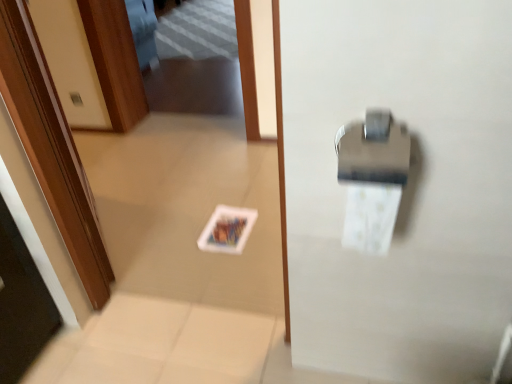
Identify the location of free space below wooden screen door at left (from a real-world perspective). (110, 237).